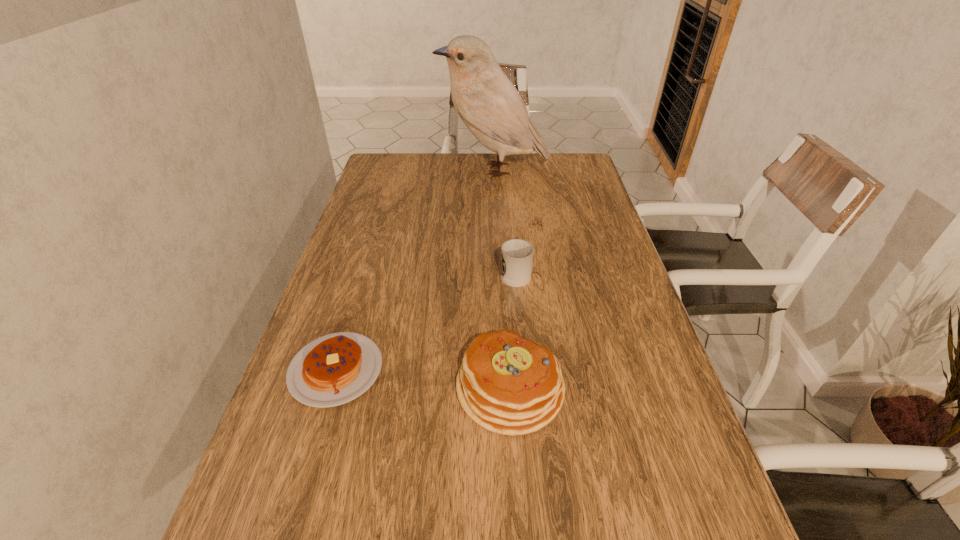
In the image, there is a desktop. Where is `vacant space at the left edge`? vacant space at the left edge is located at coordinates (371, 189).

Locate an element on the screen. free space at the right edge of the desktop is located at coordinates (x=564, y=200).

In order to click on free space at the far left corner in this screenshot , I will do `click(406, 159)`.

Identify the location of blank space at the far right corner. (583, 166).

Where is `vacant space in between the left pancake and the second shortest object`? vacant space in between the left pancake and the second shortest object is located at coordinates (425, 321).

Locate an element on the screen. empty space between the farthest object and the shorter pancake is located at coordinates (415, 270).

The image size is (960, 540). Find the location of `vacant space that is in between the tallest object and the cup`. vacant space that is in between the tallest object and the cup is located at coordinates (505, 221).

Identify the location of vacant area that lies between the second farthest object and the left pancake. (425, 321).

Image resolution: width=960 pixels, height=540 pixels. Identify the location of empty space that is in between the shorter pancake and the parakeet. (415, 270).

At what (x,y) coordinates should I click in order to perform the action: click on free space between the right pancake and the cup. Please return your answer as a coordinate pair (x, y). The width and height of the screenshot is (960, 540). Looking at the image, I should click on (513, 330).